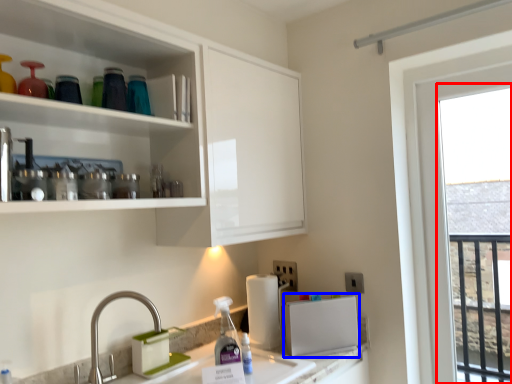
Question: Which of the following is the farthest to the observer, window (highlighted by a red box) or appliance (highlighted by a blue box)?

Choices:
 (A) window
 (B) appliance

Answer: (B)